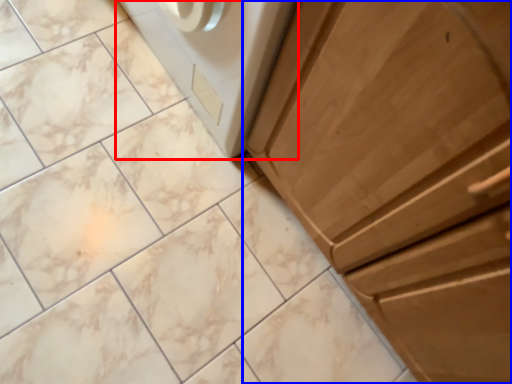
Question: Which of the following is the farthest to the observer, home appliance (highlighted by a red box) or cabinetry (highlighted by a blue box)?

Choices:
 (A) home appliance
 (B) cabinetry

Answer: (A)